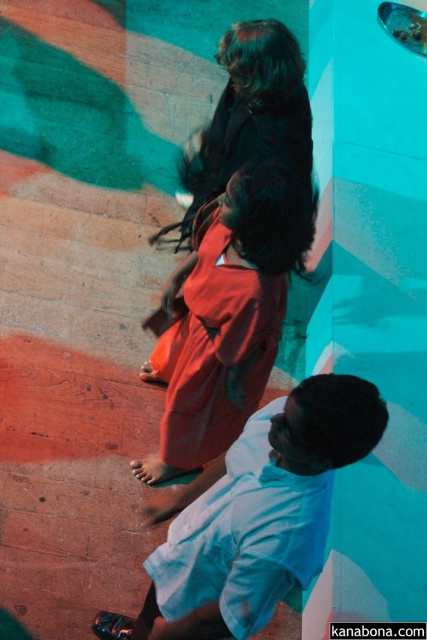
This screenshot has height=640, width=427. What do you see at coordinates (253, 516) in the screenshot?
I see `white cotton shirt at lower center` at bounding box center [253, 516].

Does white cotton shirt at lower center have a smaller size compared to matte red dress at center?

No, white cotton shirt at lower center is not smaller than matte red dress at center.

Who is more distant from viewer, (318, 504) or (216, 316)?

The point (216, 316) is behind.

The width and height of the screenshot is (427, 640). I want to click on white cotton shirt at lower center, so click(253, 516).